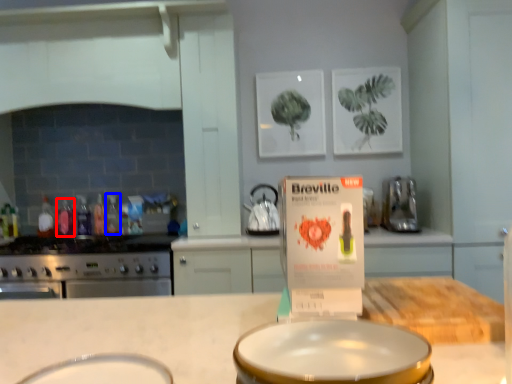
Question: Which of the following is the closest to the observer, bottle (highlighted by a red box) or bottle (highlighted by a blue box)?

Choices:
 (A) bottle
 (B) bottle

Answer: (B)